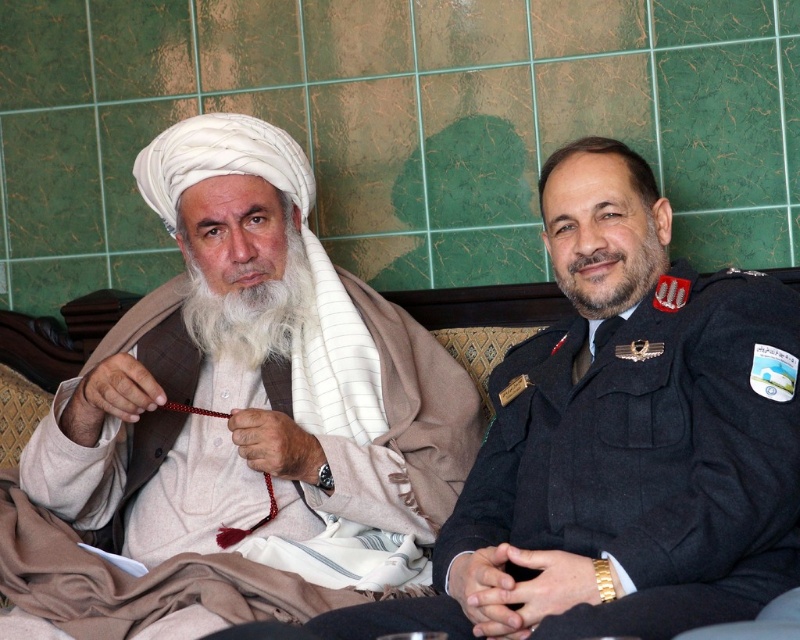
You are designing a museum exhibit where the white woolen turban at left and the dark blue uniform at right will be displayed side by side. The display case has a width of 1.2 meters. If the turban takes up 0.4 meters and the uniform requires 0.6 meters of space, will both items fit within the display case?

The white woolen turban at left requires 0.4 meters and the dark blue uniform at right requires 0.6 meters, totaling 1.0 meters. Since the display case is 1.2 meters wide, both items will fit with 0.2 meters of extra space remaining.

You are standing in the room where the two individuals are seated. You need to place a small table between the two points marked as point (380, 458) and point (660, 324). Which point should the table be closer to in order to be placed behind the individual on the right?

The table should be placed closer to point (660, 324) because point (380, 458) is behind point (660, 324), so placing the table near point (660, 324) ensures it is in front of the individual on the right.